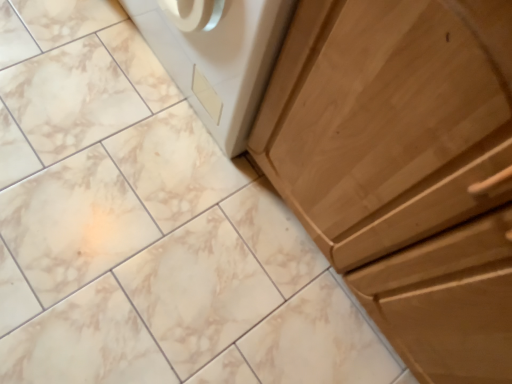
Question: In the image, is wooden cabinet at right positioned in front of or behind white glossy washing machine at upper center?

Choices:
 (A) behind
 (B) front

Answer: (B)

Question: Is wooden cabinet at right inside or outside of white glossy washing machine at upper center?

Choices:
 (A) outside
 (B) inside

Answer: (A)

Question: Does point (320, 6) appear closer or farther from the camera than point (200, 19)?

Choices:
 (A) closer
 (B) farther

Answer: (A)

Question: From the image's perspective, relative to wooden cabinet at right, is white glossy washing machine at upper center above or below?

Choices:
 (A) above
 (B) below

Answer: (A)

Question: Would you say white glossy washing machine at upper center is to the left or to the right of wooden cabinet at right in the picture?

Choices:
 (A) left
 (B) right

Answer: (A)

Question: Considering the positions of white glossy washing machine at upper center and wooden cabinet at right in the image, is white glossy washing machine at upper center wider or thinner than wooden cabinet at right?

Choices:
 (A) wide
 (B) thin

Answer: (B)

Question: Considering the positions of point (257, 31) and point (338, 233), is point (257, 31) closer or farther from the camera than point (338, 233)?

Choices:
 (A) closer
 (B) farther

Answer: (A)